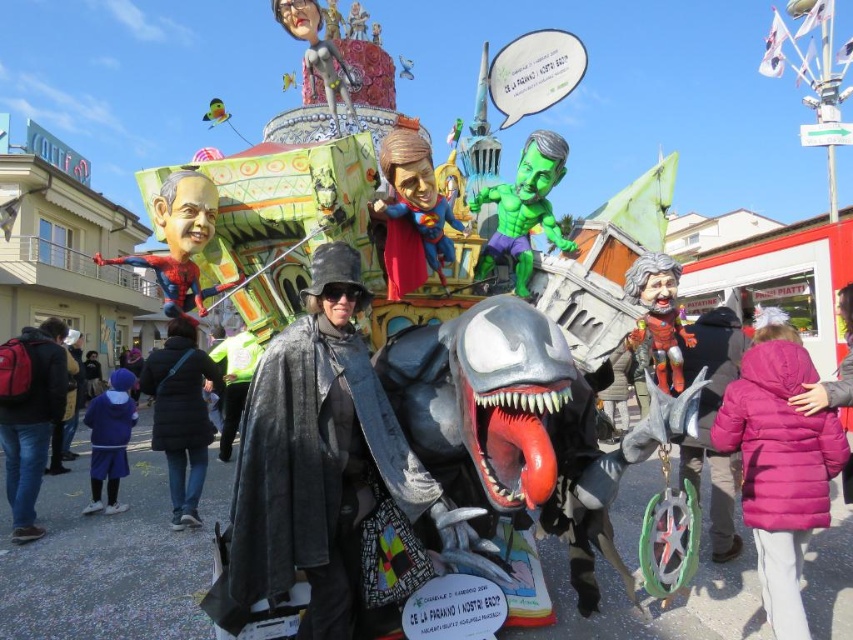
Question: Which point is closer to the camera?

Choices:
 (A) click(160, 444)
 (B) click(517, 176)
 (C) click(184, 244)

Answer: (C)

Question: From the image, what is the correct spatial relationship of denim jacket at lower left in relation to blue fabric pants at lower left?

Choices:
 (A) right
 (B) left

Answer: (B)

Question: Which object is closer to the camera taking this photo?

Choices:
 (A) matte brown wooden figure at center
 (B) shiny metallic superhero at center
 (C) black fabric coat at center

Answer: (B)

Question: Can you confirm if denim jacket at lower left is positioned below green rubber toy at center?

Choices:
 (A) yes
 (B) no

Answer: (A)

Question: Which of the following is the farthest from the observer?

Choices:
 (A) denim jacket at lower left
 (B) green rubber toy at center
 (C) matte plastic spider-man at left

Answer: (A)

Question: Is shiny metallic superhero at center positioned before matte plastic spider-man at left?

Choices:
 (A) yes
 (B) no

Answer: (B)